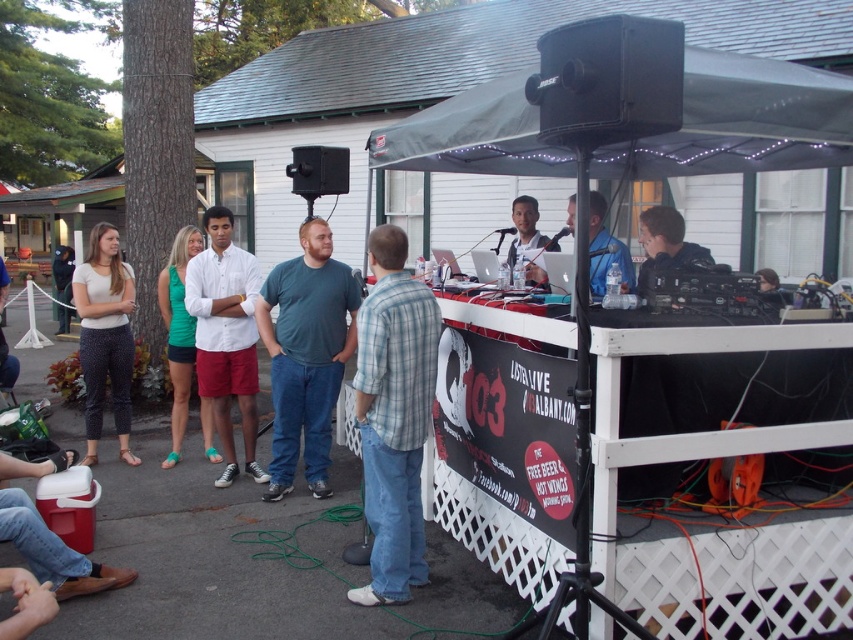
You are standing at the camera position and want to adjust the volume of the black plastic speaker at upper center. If you can reach up to 20 feet, can you reach it without moving?

The black plastic speaker at upper center is 20.82 feet away from the camera, which is slightly beyond your reach of 20 feet. You would need to move closer to adjust the volume.